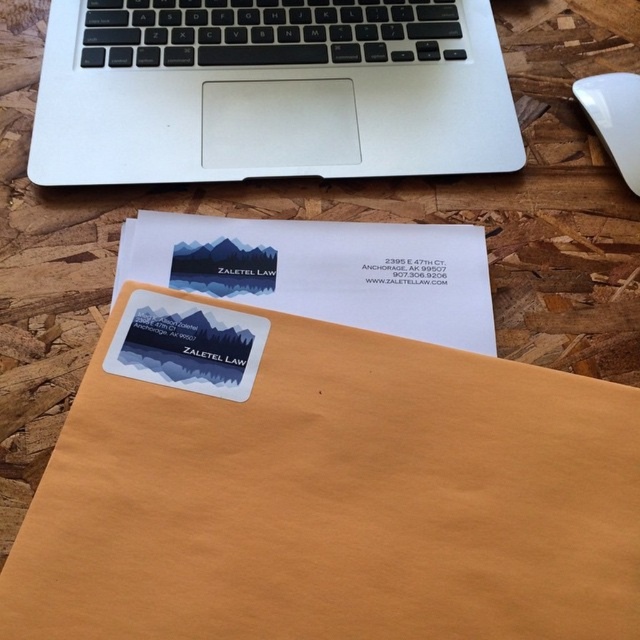
Who is more forward, (465, 164) or (196, 216)?

Point (196, 216) is in front.

Where is `silver metallic laptop at upper center`? The height and width of the screenshot is (640, 640). silver metallic laptop at upper center is located at coordinates (269, 90).

Find the location of `silver metallic laptop at upper center`. silver metallic laptop at upper center is located at coordinates (269, 90).

Is brown paper envelope at center shorter than silver metallic laptop at upper center?

Result: Correct, brown paper envelope at center is not as tall as silver metallic laptop at upper center.

Which is above, brown paper envelope at center or silver metallic laptop at upper center?

silver metallic laptop at upper center is higher up.

Between point (531, 372) and point (513, 141), which one is positioned behind?

The point (513, 141) is behind.

Find the location of a particular element. brown paper envelope at center is located at coordinates (333, 500).

Does brown paper envelope at center have a greater height compared to white plastic mouse at upper right?

Yes, brown paper envelope at center is taller than white plastic mouse at upper right.

Between point (56, 588) and point (596, 93), which one is positioned in front?

Point (56, 588)

Is point (230, 307) farther from camera compared to point (611, 144)?

That is False.

Where is `brown paper envelope at center`? The height and width of the screenshot is (640, 640). brown paper envelope at center is located at coordinates (333, 500).